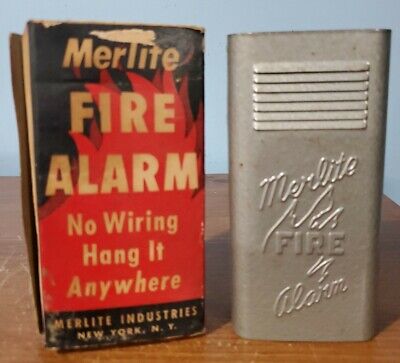
This screenshot has height=363, width=400. I want to click on vents, so click(x=319, y=85).